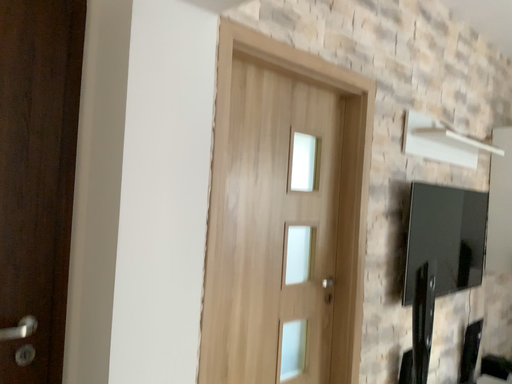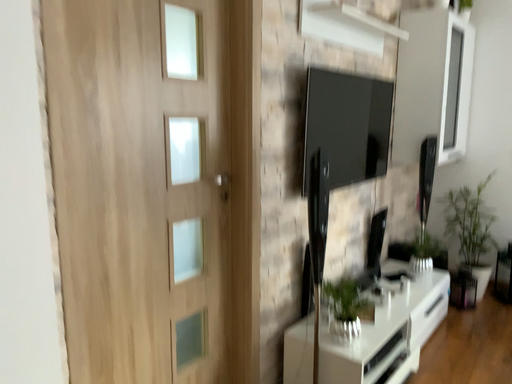
Question: How did the camera likely rotate when shooting the video?

Choices:
 (A) rotated downward
 (B) rotated upward

Answer: (A)